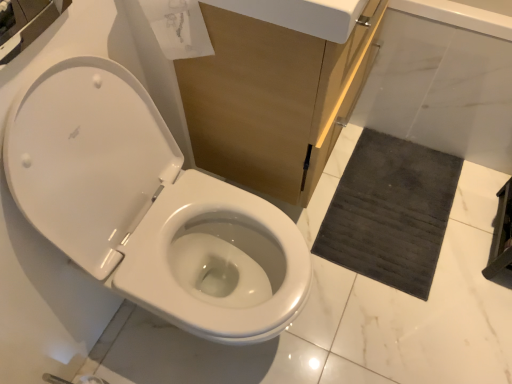
Locate an element on the screen. free space above dark gray textured bath mat at lower right (from a real-world perspective) is located at coordinates (390, 205).